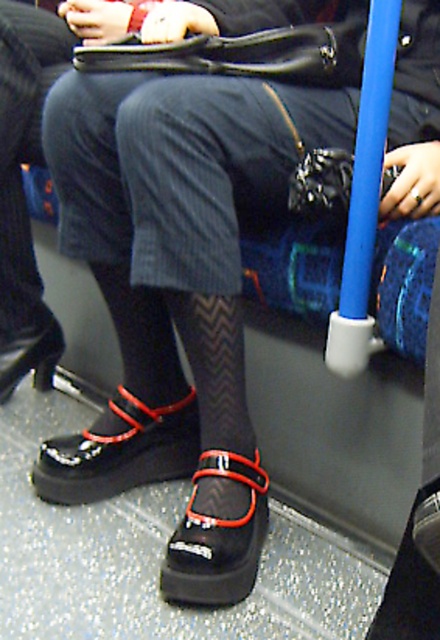
Based on the photo, is black suede mary jane shoes at lower center behind black leather shoe at lower left?

No, it is not.

Between point (190, 464) and point (33, 342), which one is positioned in front?

Point (190, 464) is in front.

Describe the element at coordinates (120, 451) in the screenshot. I see `black suede mary jane shoes at lower center` at that location.

At what (x,y) coordinates should I click in order to perform the action: click on black suede mary jane shoes at lower center. Please return your answer as a coordinate pair (x, y). This screenshot has width=440, height=640. Looking at the image, I should click on (120, 451).

Does black suede mary jane shoes at lower center have a greater width compared to black leather mary jane shoe at lower center?

Yes, black suede mary jane shoes at lower center is wider than black leather mary jane shoe at lower center.

Who is more forward, (154,410) or (195,529)?

Point (195,529) is in front.

Between point (156, 412) and point (211, 570), which one is positioned in front?

Point (211, 570) is more forward.

Where is `black suede mary jane shoes at lower center`? black suede mary jane shoes at lower center is located at coordinates (120, 451).

Between point (3, 273) and point (40, 356), which one is positioned behind?

The point (40, 356) is more distant.

Is black mesh tights at lower center to the right of black leather shoe at lower left from the viewer's perspective?

Indeed, black mesh tights at lower center is positioned on the right side of black leather shoe at lower left.

Is point (21, 179) more distant than point (7, 385)?

No, (21, 179) is closer to viewer.

The height and width of the screenshot is (640, 440). I want to click on black mesh tights at lower center, so click(22, 196).